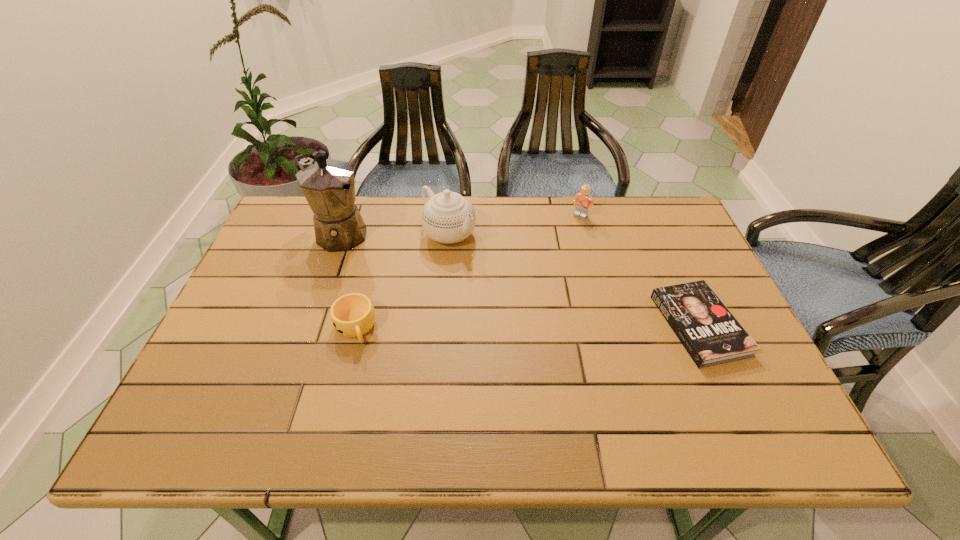
This screenshot has height=540, width=960. Find the location of `Lego located in the far edge section of the desktop`. Lego located in the far edge section of the desktop is located at coordinates pyautogui.click(x=583, y=199).

Identify the location of coffeepot that is at the far edge. This screenshot has width=960, height=540. (x=328, y=185).

You are a GUI agent. You are given a task and a screenshot of the screen. Output one action in this format:
    pyautogui.click(x=<x>, y=<y>)
    Task: Click on the object that is positioned at the near edge
    The image size is (960, 540).
    Given the screenshot: What is the action you would take?
    pyautogui.click(x=709, y=332)

Image resolution: width=960 pixels, height=540 pixels. In order to click on object that is positioned at the left edge in this screenshot , I will do `click(328, 185)`.

Locate an element on the screen. object that is at the right edge is located at coordinates (709, 332).

Image resolution: width=960 pixels, height=540 pixels. Identify the location of object located at the far left corner. (328, 185).

Identify the location of object that is at the near right corner. (709, 332).

Find the location of a particular element. vacant space at the far edge of the desktop is located at coordinates pos(387,214).

Where is `vacant space at the near edge`? vacant space at the near edge is located at coordinates (367, 394).

I want to click on free point at the left edge, so click(x=300, y=257).